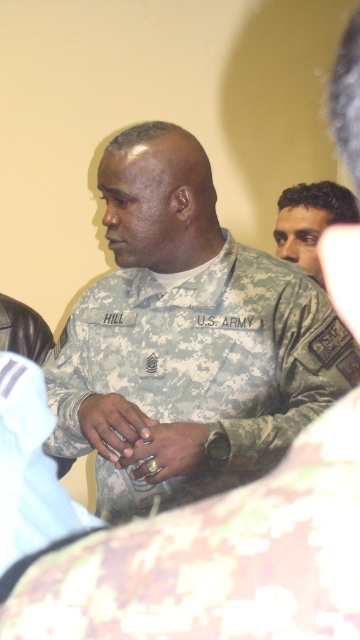
You are an observer standing in front of the image. There is a point at coordinates (165, 451). What object is located at that point?

The gold metallic ring at center is located at point (165, 451).

Looking at the image of the U.S. Army soldier, can you determine if the dark brown hair at upper right is bigger than the gold metallic ring at center?

The dark brown hair at upper right is larger in size than gold metallic ring at center according to the description.